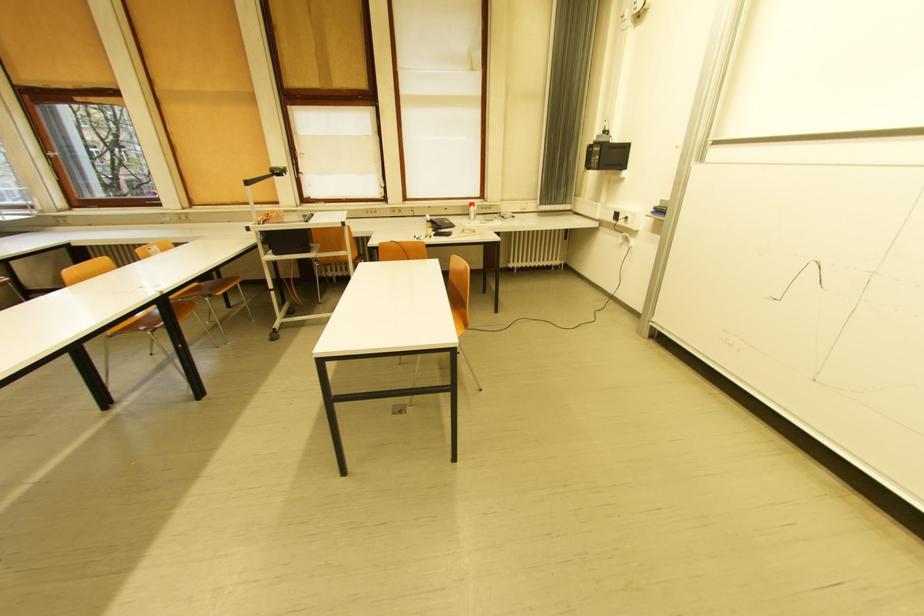
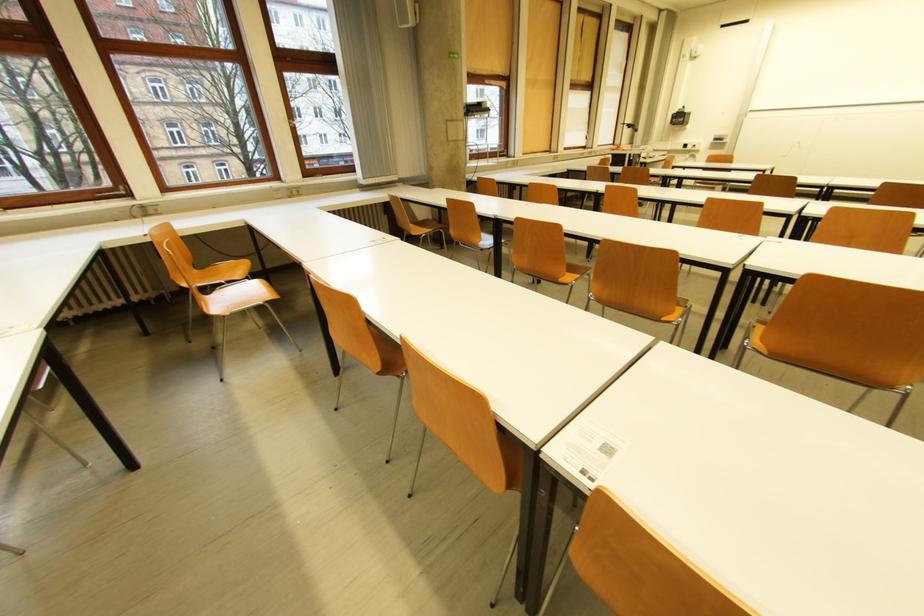
Locate, in the second image, the point that corresponds to (623,217) in the first image.

(691, 147)